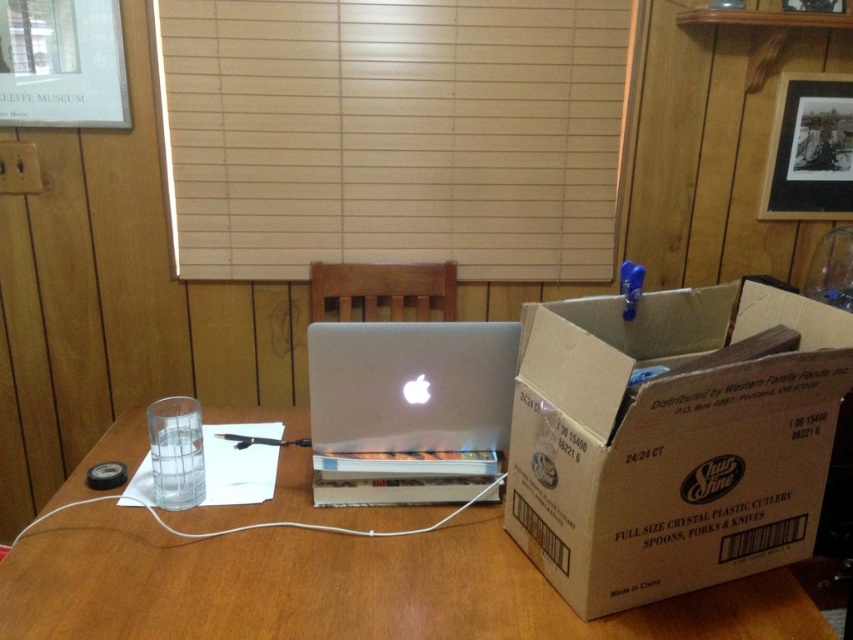
You are a person sitting at the wooden table in the workspace. You need to reach two points marked on the table. The first point is at coordinate point(187, 621) and the second point is at coordinate point(326, 328). Which point will you reach first if you move towards them from your sitting position?

Point(187, 621) is in front of point(326, 328), so you will reach point(187, 621) first.

You are organizing items in a workspace. You need to place a new item on the tallest object available. Which object should you choose between the brown cardboard box at right and the wooden table at center?

The brown cardboard box at right is much taller than the wooden table at center, so you should place the new item on the brown cardboard box at right.

You are organizing items on a wooden table. You have a brown cardboard box at right and a silver metallic laptop at center. Which item should you move if you need to free up space for a larger object that requires more room than either currently occupies?

The brown cardboard box at right is larger in size than the silver metallic laptop at center, so you should move the brown cardboard box at right to free up more space.